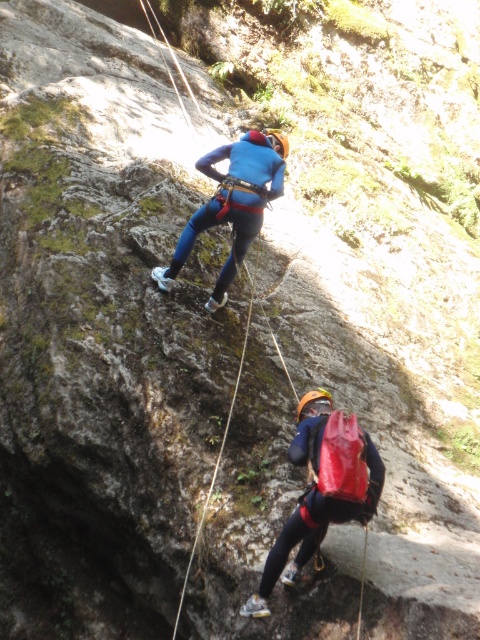
You are a safety inspector reviewing this climbing scene. You notice the matte red backpack at lower center and the blue matte climbing suit at center. According to safety protocols, the backpack should be above the climber to avoid snagging on rocks. Is the current positioning compliant with safety standards?

The matte red backpack at lower center is positioned under the blue matte climbing suit at center, which violates safety protocols as the backpack should be above the climber to prevent snagging on rocks.

You are a drone operator trying to capture the best shot of the matte red backpack at lower center. The drone has a camera with a 100mm focal length lens. Given the coordinates provided, can you determine if the backpack is positioned within the camera frame? Please explain your reasoning.

The coordinates of the matte red backpack at lower center are at point (322, 490). However, without knowing the camera frame dimensions or the field of view corresponding to the 100mm focal length, it is impossible to determine if the backpack is within the frame. Additional information about the camera sensor size or field of view is required to make this determination.

You are a safety inspector checking the climbing route. There is a critical point at coordinates point (x=324, y=524) that needs to be within 7 meters from the camera for safety. Is this point within the required distance?

The distance of point (x=324, y=524) from the camera is 6.91 meters, which is within the required 7 meters safety distance.